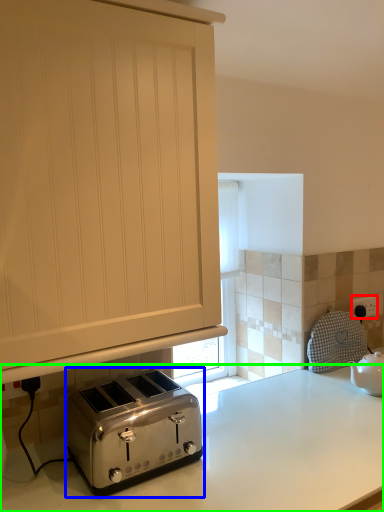
Question: Which object is positioned farthest from electric outlet (highlighted by a red box)? Select from toaster (highlighted by a blue box) and countertop (highlighted by a green box).

Choices:
 (A) toaster
 (B) countertop

Answer: (A)